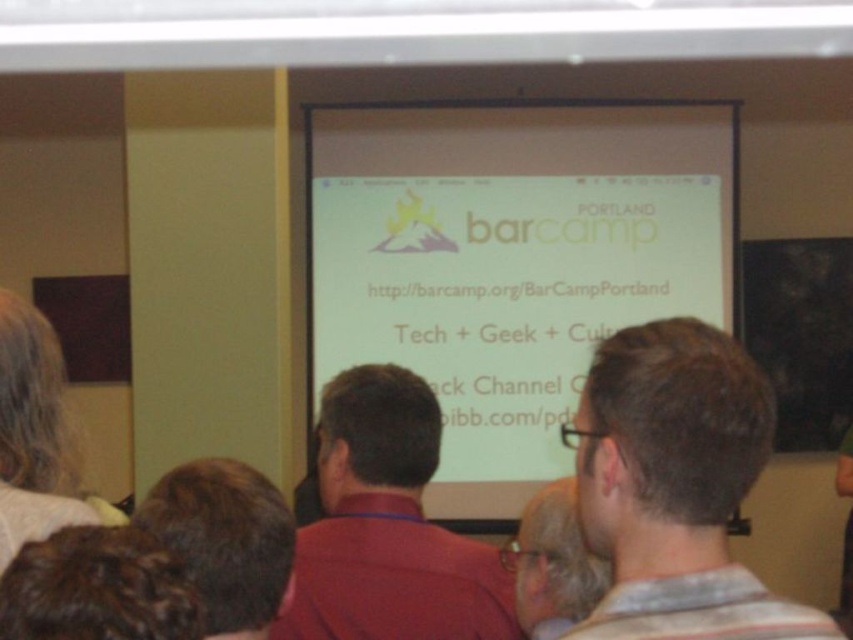
You are an attendee at the Portland Barcamp presentation. You notice two people sitting directly in front of you, both wearing shirts of different colors. The first person is wearing a red matte shirt at center, and the second is wearing a matte black shirt at center. Which shirt is closer to the projection screen?

The red matte shirt at center is located above the matte black shirt at center, meaning it is closer to the projection screen.

You are an attendee at the Portland Barcamp event. You notice the white matte projection screen at center and the red matte shirt at center. Which object is larger in size?

The white matte projection screen at center is bigger than the red matte shirt at center.

You are standing in the room where the Portland Barcamp presentation is happening. You need to locate the person wearing the red matte shirt at center. Where would you look relative to the screen?

The red matte shirt at center is located at the coordinates point 0.825 on the x axis and 0.455 on the y axis relative to the screen.